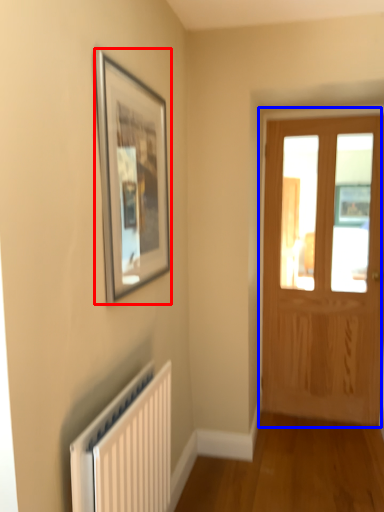
Question: Which point is closer to the camera, picture frame (highlighted by a red box) or door (highlighted by a blue box)?

Choices:
 (A) picture frame
 (B) door

Answer: (A)